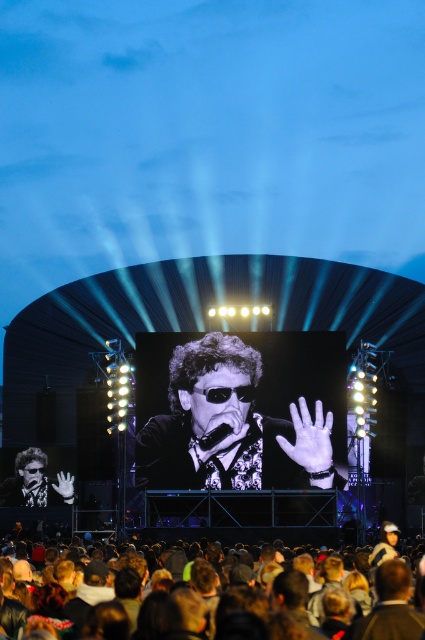
You are standing at the center of the concert stage and see two points marked in the image. Which point is closer to you, point (x=309, y=484) or point (x=42, y=474)?

Point (x=309, y=484) is in front of point (x=42, y=474), so it is closer to you.

You are attending an outdoor concert and want to take a photo of the performer wearing the black glossy sunglasses at center. The concert venue has a rule that attendees must stay at least 100 meters away from the stage. Can you safely take the photo without violating the rule?

The black glossy sunglasses at center is 103.72 meters away from viewer, so yes, you can safely take the photo without violating the 100 meter rule since the distance is more than required.

You are a photographer at the concert and want to capture a closeup of the matte black sunglasses at center. Given that your camera can focus on objects up to 100 meters away, will you be able to take the photo clearly?

The matte black sunglasses at center is 117.33 meters away from camera, which is beyond the camera focus range of 100 meters. Therefore, you won cannot take the photo clearly.